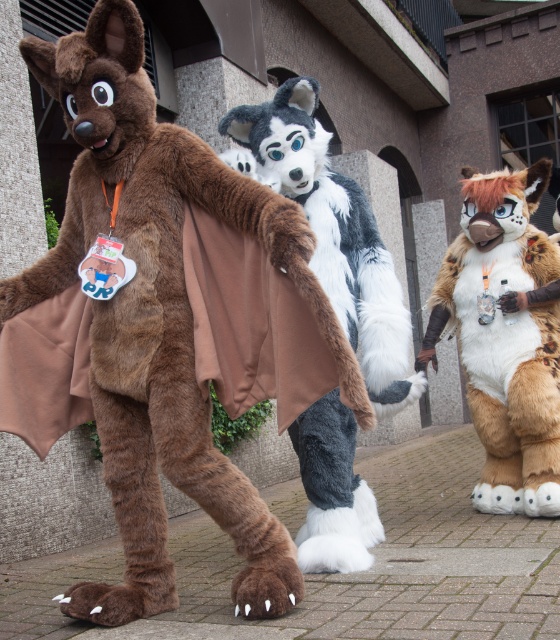
Question: Which of the following is the farthest from the observer?

Choices:
 (A) fluffy fur wolf at center
 (B) brown furry costume at left

Answer: (A)

Question: Which point is closer to the camera?

Choices:
 (A) (330, 417)
 (B) (137, 301)
 (C) (508, 404)

Answer: (B)

Question: Observing the image, what is the correct spatial positioning of fluffy fur wolf at center in reference to fluffy brown fur at center?

Choices:
 (A) below
 (B) above

Answer: (B)

Question: From the image, what is the correct spatial relationship of brown furry costume at left in relation to fluffy fur wolf at center?

Choices:
 (A) above
 (B) below

Answer: (A)

Question: Does brown furry costume at left appear over fluffy brown fur at center?

Choices:
 (A) no
 (B) yes

Answer: (B)

Question: Which point is farther to the camera?

Choices:
 (A) fluffy fur wolf at center
 (B) fluffy brown fur at center
 (C) brown furry costume at left

Answer: (B)